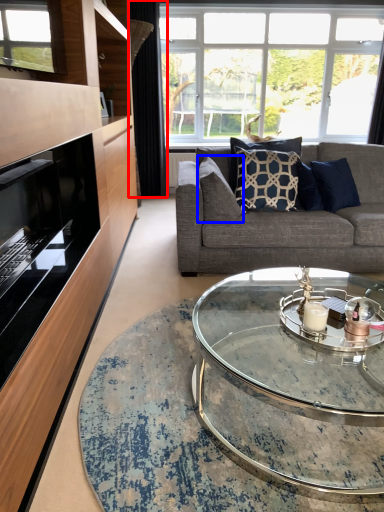
Question: Which of the following is the farthest to the observer, curtain (highlighted by a red box) or pillow (highlighted by a blue box)?

Choices:
 (A) curtain
 (B) pillow

Answer: (A)